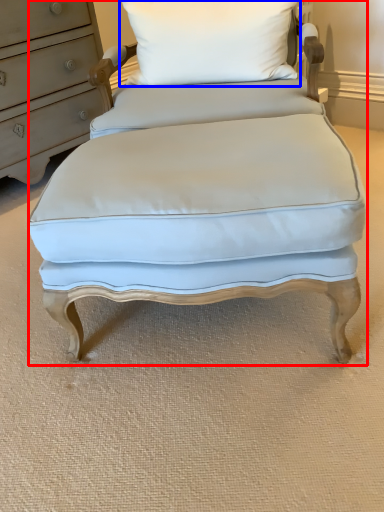
Question: Which of the following is the farthest to the observer, swivel chair (highlighted by a red box) or pillow (highlighted by a blue box)?

Choices:
 (A) swivel chair
 (B) pillow

Answer: (B)